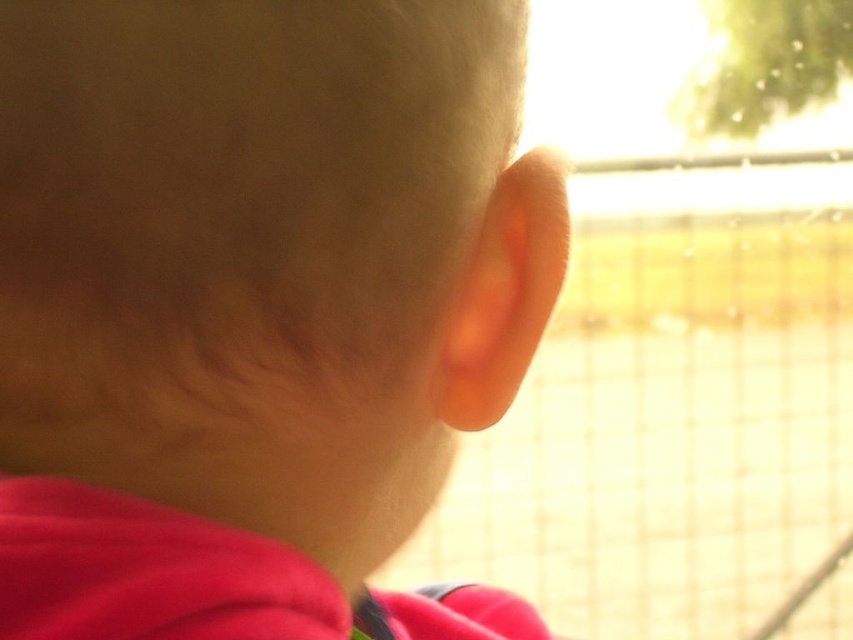
You are a photographer adjusting the lighting for a portrait. The subject has a smooth skin head at center marked by point (251, 298). If the grid pattern in the background is at point 0.6, 0.3, where should you position the main light to ensure the light hits the subject first before reaching the background?

The main light should be positioned closer to the point (251, 298) than the grid pattern at 0.6, 0.3 to ensure the light hits the subject first before reaching the background.

You are a photographer trying to capture a portrait of the smooth skin head at center through the transparent glass train window at center. Since the window is taller than the head, will the entire head fit vertically within the window frame?

The smooth skin head at center has a lesser height compared to the transparent glass train window at center, so the entire head will fit vertically within the window frame.